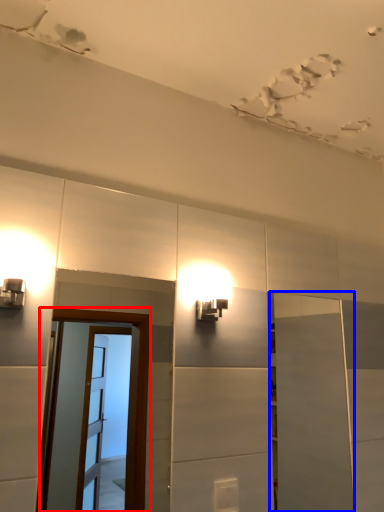
Question: Among these objects, which one is farthest to the camera, screen door (highlighted by a red box) or door (highlighted by a blue box)?

Choices:
 (A) screen door
 (B) door

Answer: (B)